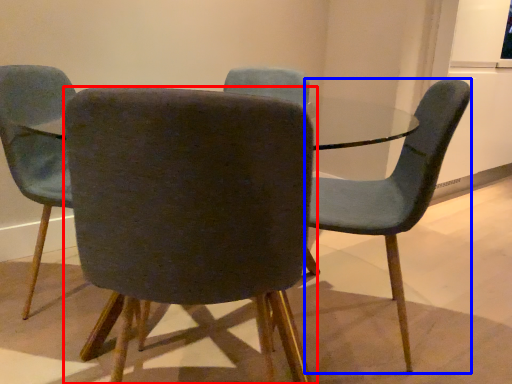
Question: Which point is closer to the camera, chair (highlighted by a red box) or chair (highlighted by a blue box)?

Choices:
 (A) chair
 (B) chair

Answer: (A)